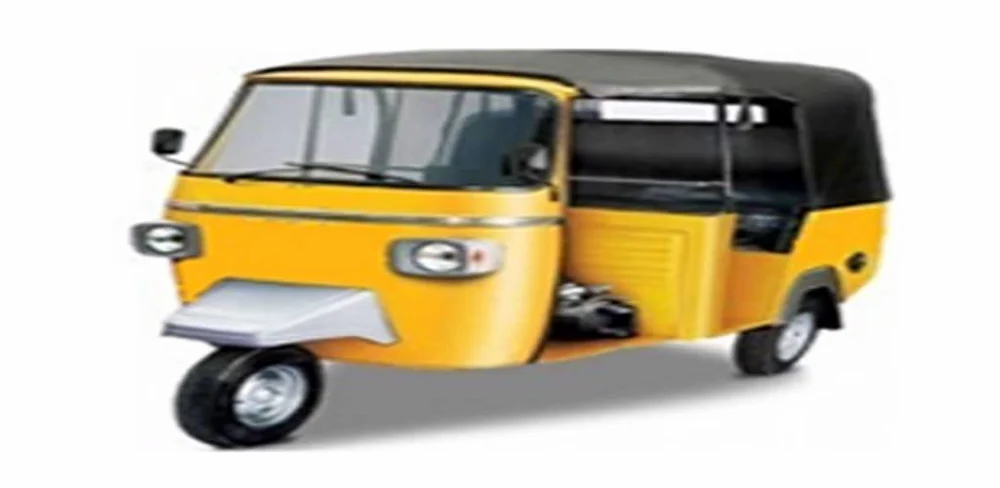
Image resolution: width=1000 pixels, height=488 pixels. What are the coordinates of `seats` in the screenshot? It's located at (697, 143).